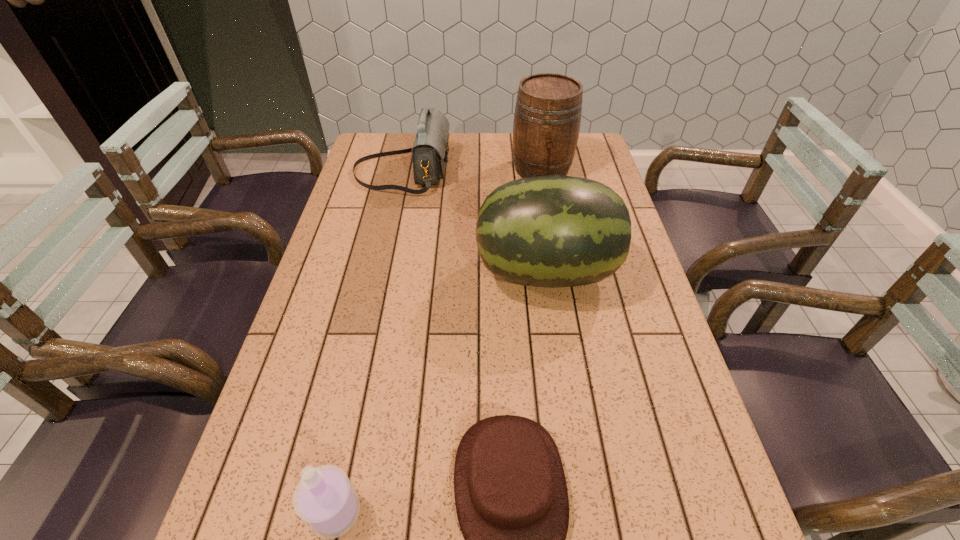
Where is `watermelon present at the right edge`? The image size is (960, 540). watermelon present at the right edge is located at coordinates (553, 231).

Find the location of a particular element. Image resolution: width=960 pixels, height=540 pixels. object that is at the far left corner is located at coordinates (430, 150).

Where is `object located in the far right corner section of the desktop`? This screenshot has width=960, height=540. object located in the far right corner section of the desktop is located at coordinates (547, 118).

The height and width of the screenshot is (540, 960). Find the location of `vacant space at the far edge`. vacant space at the far edge is located at coordinates (490, 161).

At what (x,y) coordinates should I click in order to perform the action: click on free location at the left edge of the desktop. Please return your answer as a coordinate pair (x, y). Image resolution: width=960 pixels, height=540 pixels. Looking at the image, I should click on (307, 334).

This screenshot has height=540, width=960. In order to click on vacant space at the right edge in this screenshot , I will do `click(625, 373)`.

The height and width of the screenshot is (540, 960). Find the location of `free point between the shoulder bag and the third nearest object`. free point between the shoulder bag and the third nearest object is located at coordinates (474, 222).

At what (x,y) coordinates should I click in order to perform the action: click on free point between the third farthest object and the shoulder bag. Please return your answer as a coordinate pair (x, y). The image size is (960, 540). Looking at the image, I should click on (474, 222).

In order to click on free space between the cider and the shoulder bag in this screenshot , I will do `click(472, 171)`.

This screenshot has height=540, width=960. I want to click on the closest object to the third farthest object, so click(430, 150).